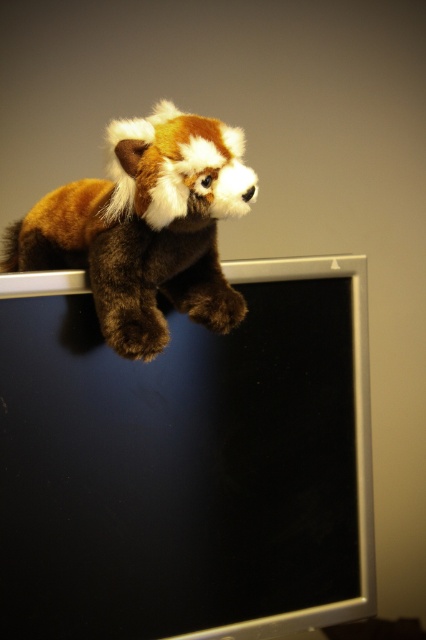
Question: Which of the following is the closest to the observer?

Choices:
 (A) (161, 520)
 (B) (196, 307)

Answer: (B)

Question: Does black matte computer monitor at upper left have a greater width compared to brown plush toy at upper left?

Choices:
 (A) no
 (B) yes

Answer: (B)

Question: Which object is farther from the camera taking this photo?

Choices:
 (A) black matte computer monitor at upper left
 (B) brown plush toy at upper left

Answer: (A)

Question: Considering the relative positions of black matte computer monitor at upper left and brown plush toy at upper left in the image provided, where is black matte computer monitor at upper left located with respect to brown plush toy at upper left?

Choices:
 (A) below
 (B) above

Answer: (A)

Question: Among these points, which one is farthest from the camera?

Choices:
 (A) (184, 243)
 (B) (106, 540)

Answer: (B)

Question: Is black matte computer monitor at upper left positioned behind brown plush toy at upper left?

Choices:
 (A) no
 (B) yes

Answer: (B)